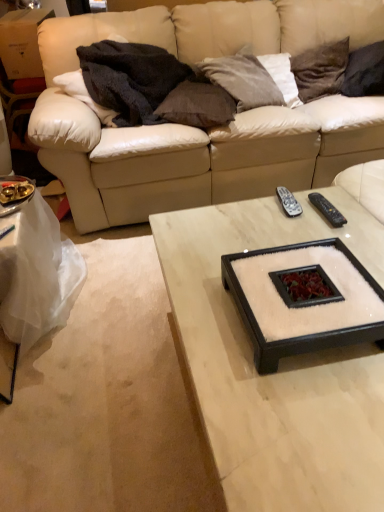
You are a GUI agent. You are given a task and a screenshot of the screen. Output one action in this format:
    pyautogui.click(x=<x>, y=<y>)
    Task: Click on the vacant area that is situated to the right of black plastic remote control at center, the 2th remote control when ordered from right to left
    The image size is (384, 512).
    Given the screenshot: What is the action you would take?
    pyautogui.click(x=334, y=206)